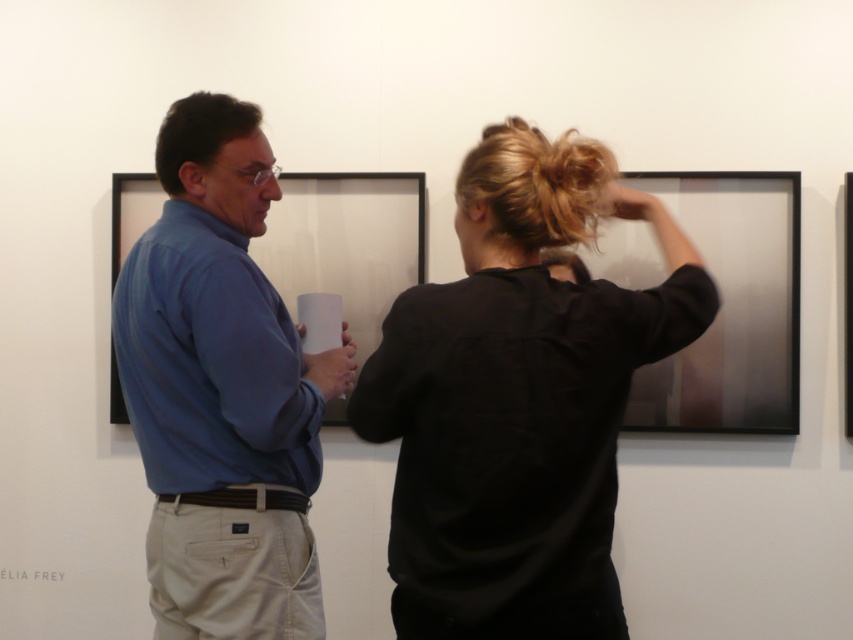
You are an art gallery assistant and need to hang a new painting that requires a frame taller than the blue cotton shirt at center. Can the matte black picture frame at upper right accommodate this requirement?

The blue cotton shirt at center is taller than the matte black picture frame at upper right, so the matte black picture frame at upper right cannot accommodate the requirement as it is shorter than the required height.

You are an art gallery attendant who needs to adjust the lighting so that both the black matte shirt at center and the matte black picture frame at upper right are illuminated. Based on their positions, which object should you focus the light on first to ensure both are properly lit?

The black matte shirt at center is below the matte black picture frame at upper right, so you should focus the light on the matte black picture frame at upper right first to ensure both are properly lit.

You are an art gallery visitor who wants to take a photo of the black matte shirt at center and the blue cotton shirt at center without any obstruction. Based on their positions, which one should you focus on first to ensure both are in the frame?

You should focus on the black matte shirt at center first since it is closer to the viewer than the blue cotton shirt at center, allowing you to adjust the camera angle to include both in the frame without obstruction.